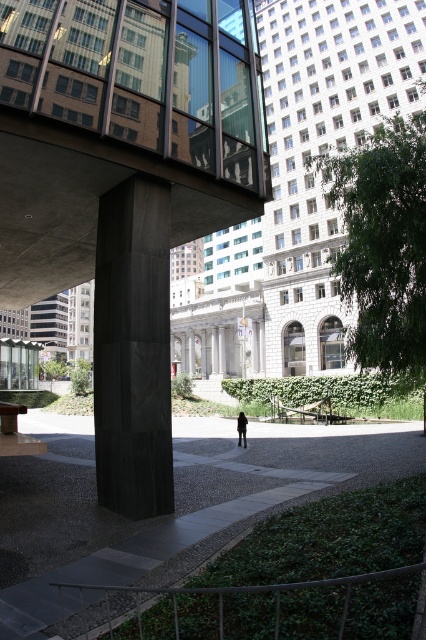
Question: Where is smooth concrete path at center located in relation to black leather jacket at center in the image?

Choices:
 (A) left
 (B) right

Answer: (A)

Question: Is smooth concrete path at center to the left of black leather jacket at center from the viewer's perspective?

Choices:
 (A) no
 (B) yes

Answer: (B)

Question: Which object is positioned farthest from the smooth concrete path at center?

Choices:
 (A) black polished stone column at center
 (B) black leather jacket at center

Answer: (B)

Question: Among these objects, which one is nearest to the camera?

Choices:
 (A) black polished stone column at center
 (B) black leather jacket at center
 (C) smooth concrete path at center

Answer: (C)

Question: In this image, where is smooth concrete path at center located relative to black leather jacket at center?

Choices:
 (A) right
 (B) left

Answer: (B)

Question: Which is farther from the black leather jacket at center?

Choices:
 (A) black polished stone column at center
 (B) smooth concrete path at center

Answer: (A)